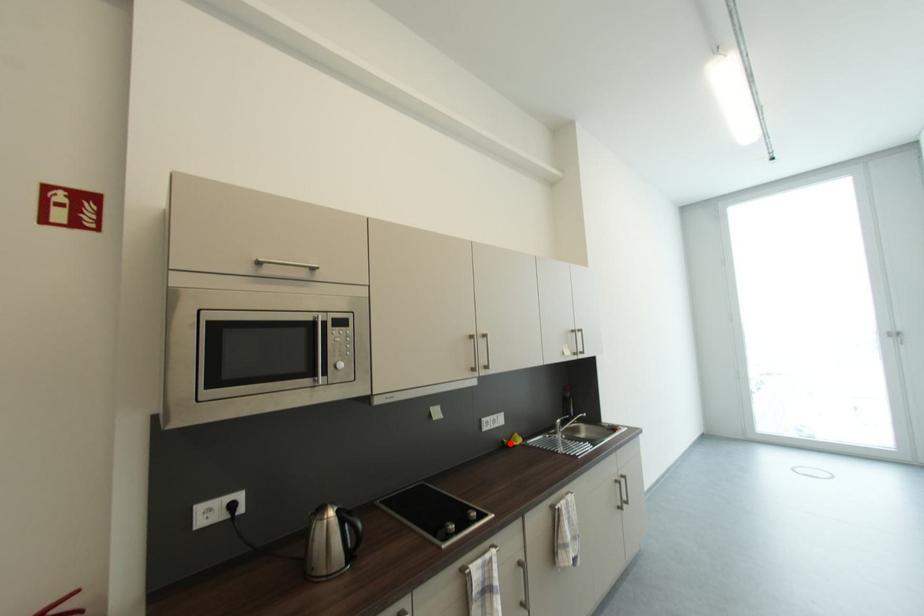
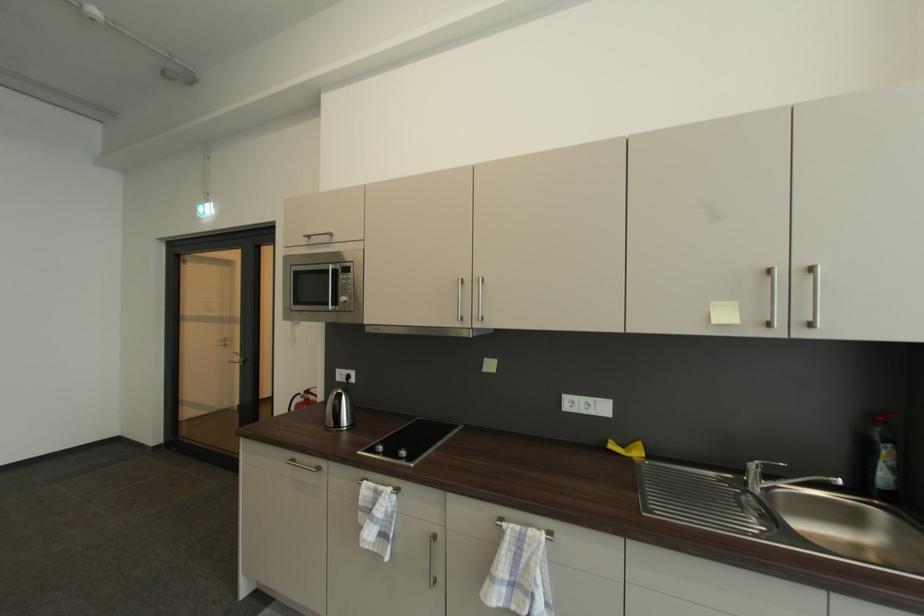
Where in the second image is the point corresponding to the highlighted location from the first image?

(613, 443)